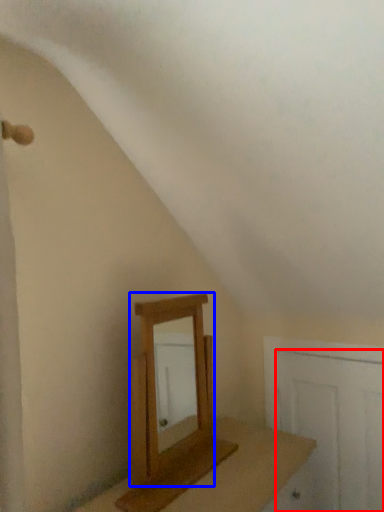
Question: Which object is closer to the camera taking this photo, door (highlighted by a red box) or mirror (highlighted by a blue box)?

Choices:
 (A) door
 (B) mirror

Answer: (B)